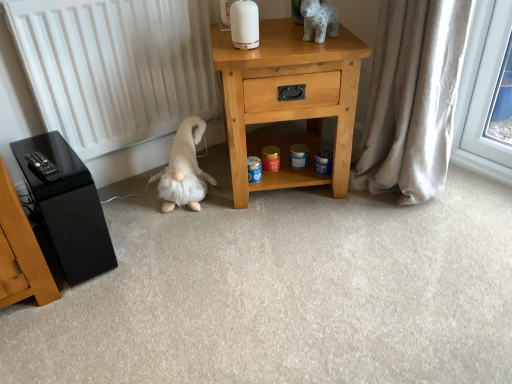
This screenshot has width=512, height=384. Find the location of `vacant space in front of light wood nightstand at center`. vacant space in front of light wood nightstand at center is located at coordinates (291, 244).